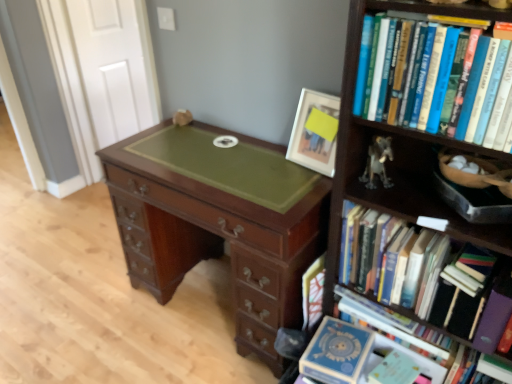
Where is `hardcover books at upper right, the fourth book from the bottom`? This screenshot has height=384, width=512. hardcover books at upper right, the fourth book from the bottom is located at coordinates (482, 96).

Where is `wooden bookcase at right`? This screenshot has height=384, width=512. wooden bookcase at right is located at coordinates (x=399, y=153).

Describe the element at coordinates (218, 222) in the screenshot. I see `mahogany wood desk at center` at that location.

You are a GUI agent. You are given a task and a screenshot of the screen. Output one action in this format:
    pyautogui.click(x=<x>, y=<y>)
    Task: Click on the hardcover books at right, marked as the first book in a bottom-to-top arrangement
    The height and width of the screenshot is (384, 512).
    Given the screenshot: What is the action you would take?
    pyautogui.click(x=385, y=320)

How much space does hardcover books at right, which appears as the second book when viewed from the top, occupy horizontally?

hardcover books at right, which appears as the second book when viewed from the top, is 10.10 inches in width.

Identify the location of hardcover books at upper right, which is the first book from top to bottom. Image resolution: width=512 pixels, height=384 pixels. (482, 96).

Considering the positions of objects white matte door at upper left and matte white picture frame at upper right in the image provided, who is more to the right, white matte door at upper left or matte white picture frame at upper right?

matte white picture frame at upper right is more to the right.

Are white matte door at upper left and matte white picture frame at upper right beside each other?

No, white matte door at upper left is not touching matte white picture frame at upper right.

From a real-world perspective, between wooden bookcase at right and mahogany wood desk at center, who is vertically lower?

From a 3D spatial view, mahogany wood desk at center is below.

Would you consider wooden bookcase at right to be distant from mahogany wood desk at center?

wooden bookcase at right is actually quite close to mahogany wood desk at center.

Considering the positions of objects wooden bookcase at right and mahogany wood desk at center in the image provided, who is more to the left, wooden bookcase at right or mahogany wood desk at center?

mahogany wood desk at center is more to the left.

Looking at their sizes, would you say wooden bookcase at right is wider or thinner than white matte door at upper left?

wooden bookcase at right is wider than white matte door at upper left.

Who is bigger, wooden bookcase at right or white matte door at upper left?

wooden bookcase at right is bigger.

Image resolution: width=512 pixels, height=384 pixels. What are the coordinates of `door below the wooden bookcase at right (from a real-world perspective)` in the screenshot? It's located at (115, 66).

From the image's perspective, which one is positioned higher, wooden bookcase at right or white matte door at upper left?

white matte door at upper left is shown above in the image.

Does mahogany wood desk at center appear on the right side of hardcover books at upper right, which is the first book from top to bottom?

No, mahogany wood desk at center is not to the right of hardcover books at upper right, which is the first book from top to bottom.

Where is `desk that is behind the hardcover books at upper right, which is the first book from top to bottom`? This screenshot has height=384, width=512. desk that is behind the hardcover books at upper right, which is the first book from top to bottom is located at coordinates (218, 222).

From a real-world perspective, is mahogany wood desk at center physically located above or below hardcover books at upper right, the fourth book from the bottom?

From a real-world perspective, mahogany wood desk at center is physically below hardcover books at upper right, the fourth book from the bottom.

Could you tell me if mahogany wood desk at center is facing hardcover books at upper right, which is the first book from top to bottom?

No, mahogany wood desk at center does not turn towards hardcover books at upper right, which is the first book from top to bottom.

From the image's perspective, between white matte door at upper left and mahogany wood desk at center, which one is located above?

white matte door at upper left is shown above in the image.

Can you confirm if white matte door at upper left is taller than mahogany wood desk at center?

Indeed, white matte door at upper left has a greater height compared to mahogany wood desk at center.

Based on the photo, can mahogany wood desk at center be found inside white matte door at upper left?

No, mahogany wood desk at center is not surrounded by white matte door at upper left.

Is white matte door at upper left turned away from mahogany wood desk at center?

white matte door at upper left does not have its back to mahogany wood desk at center.

From a real-world perspective, count 3rd books downward from the hardcover books at upper right, the fourth book from the bottom, and point to it. Please provide its 2D coordinates.

[(385, 320)]

In terms of width, does hardcover books at right, which is the fourth book in top-to-bottom order, look wider or thinner when compared to hardcover books at upper right, the fourth book from the bottom?

hardcover books at right, which is the fourth book in top-to-bottom order, is wider than hardcover books at upper right, the fourth book from the bottom.

Is hardcover books at right, which is the fourth book in top-to-bottom order, shorter than hardcover books at upper right, the fourth book from the bottom?

No, hardcover books at right, which is the fourth book in top-to-bottom order, is not shorter than hardcover books at upper right, the fourth book from the bottom.

Which object is more forward, hardcover books at right, which is the fourth book in top-to-bottom order, or hardcover books at upper right, the fourth book from the bottom?

hardcover books at upper right, the fourth book from the bottom.

Which is closer, (x=372, y=163) or (x=338, y=306)?

The point (x=372, y=163) is closer to the camera.

From the image's perspective, is metallic silver figurine at upper right positioned above or below hardcover books at right, marked as the first book in a bottom-to-top arrangement?

From the image's perspective, metallic silver figurine at upper right appears above hardcover books at right, marked as the first book in a bottom-to-top arrangement.

In the scene shown: Based on their sizes in the image, would you say metallic silver figurine at upper right is bigger or smaller than hardcover books at right, which is the fourth book in top-to-bottom order?

Considering their sizes, metallic silver figurine at upper right takes up less space than hardcover books at right, which is the fourth book in top-to-bottom order.

Based on the photo, considering the positions of objects metallic silver figurine at upper right and hardcover books at right, which is the fourth book in top-to-bottom order, in the image provided, who is more to the right, metallic silver figurine at upper right or hardcover books at right, which is the fourth book in top-to-bottom order,?

Positioned to the right is hardcover books at right, which is the fourth book in top-to-bottom order.

You are a GUI agent. You are given a task and a screenshot of the screen. Output one action in this format:
    pyautogui.click(x=<x>, y=<y>)
    Task: Click on the picture frame on the right of the white matte door at upper left
    This screenshot has width=512, height=384.
    Given the screenshot: What is the action you would take?
    pyautogui.click(x=315, y=132)

This screenshot has width=512, height=384. I want to click on desk located on the left of wooden bookcase at right, so click(x=218, y=222).

Which object lies further to the anchor point mahogany wood desk at center, wooden bookcase at right or matte white picture frame at upper right?

wooden bookcase at right is further to mahogany wood desk at center.

Which object lies nearer to the anchor point matte white picture frame at upper right, hardcover book at center, acting as the third book starting from the top, or mahogany wood desk at center?

mahogany wood desk at center.

Which object lies nearer to the anchor point white matte door at upper left, mahogany wood desk at center or hardcover books at right, which is the fourth book in top-to-bottom order?

Based on the image, mahogany wood desk at center appears to be nearer to white matte door at upper left.

From the image, which object appears to be farther from hardcover books at upper right, which is the first book from top to bottom, hardcover books at right, the third book positioned from the bottom, or wooden bookcase at right?

The object further to hardcover books at upper right, which is the first book from top to bottom, is hardcover books at right, the third book positioned from the bottom.

Looking at the image, which one is located further to matte white picture frame at upper right, hardcover books at upper right, which is the first book from top to bottom, or hardcover books at right, the third book positioned from the bottom?

hardcover books at upper right, which is the first book from top to bottom, is further to matte white picture frame at upper right.

In the scene shown: Considering their positions, is white matte door at upper left positioned closer to hardcover books at right, which appears as the second book when viewed from the top, than wooden bookcase at right?

wooden bookcase at right.

Looking at the image, which one is located closer to matte white picture frame at upper right, wooden bookcase at right or hardcover books at right, which is the fourth book in top-to-bottom order?

Among the two, wooden bookcase at right is located nearer to matte white picture frame at upper right.

Considering their positions, is matte white picture frame at upper right positioned closer to white matte door at upper left than wooden bookcase at right?

matte white picture frame at upper right lies closer to white matte door at upper left than the other object.

Find the location of a particular element. book between mahogany wood desk at center and metallic silver figurine at upper right in the horizontal direction is located at coordinates (313, 292).

Identify the location of toy between hardcover books at upper right, the fourth book from the bottom, and matte white picture frame at upper right in the front-back direction. (377, 162).

Find the location of `picture frame between mahogany wood desk at center and hardcover books at right, the third book positioned from the bottom`. picture frame between mahogany wood desk at center and hardcover books at right, the third book positioned from the bottom is located at coordinates (315, 132).

At what (x,y) coordinates should I click in order to perform the action: click on toy positioned between wooden bookcase at right and hardcover book at center, acting as the third book starting from the top, from near to far. Please return your answer as a coordinate pair (x, y). This screenshot has height=384, width=512. Looking at the image, I should click on (377, 162).